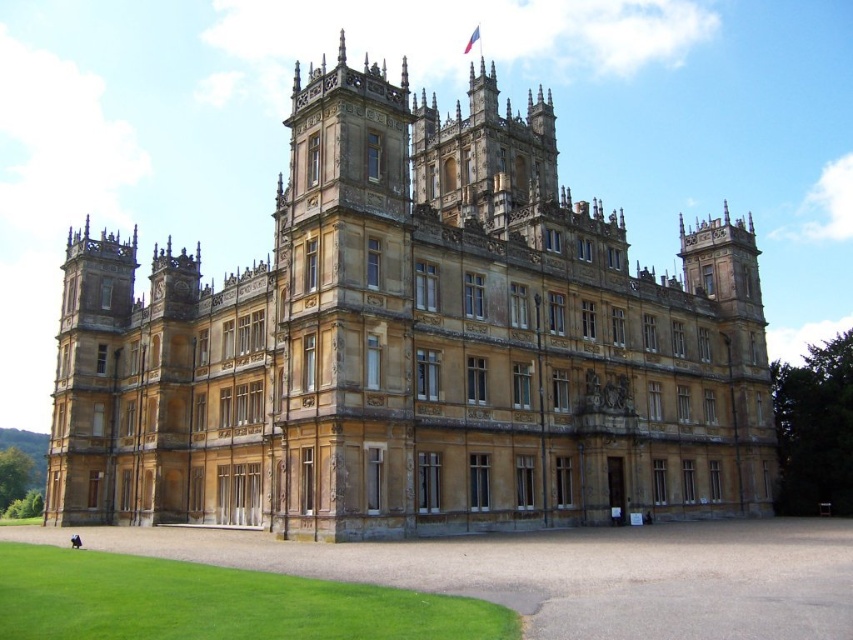
Measure the distance from golden stone castle at center to green grass at lower left.

30.91 meters

Looking at this image, is golden stone castle at center thinner than green grass at lower left?

In fact, golden stone castle at center might be wider than green grass at lower left.

The width and height of the screenshot is (853, 640). What do you see at coordinates (415, 346) in the screenshot? I see `golden stone castle at center` at bounding box center [415, 346].

I want to click on golden stone castle at center, so click(x=415, y=346).